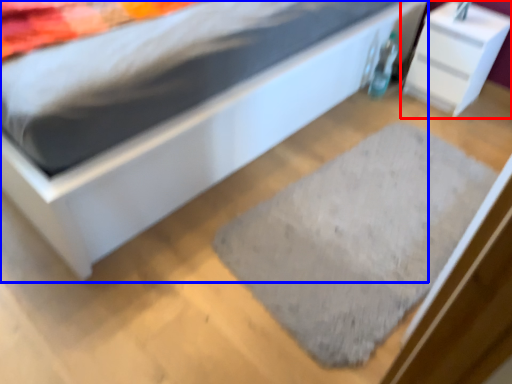
Question: Which point is further to the camera, nightstand (highlighted by a red box) or bed (highlighted by a blue box)?

Choices:
 (A) nightstand
 (B) bed

Answer: (A)